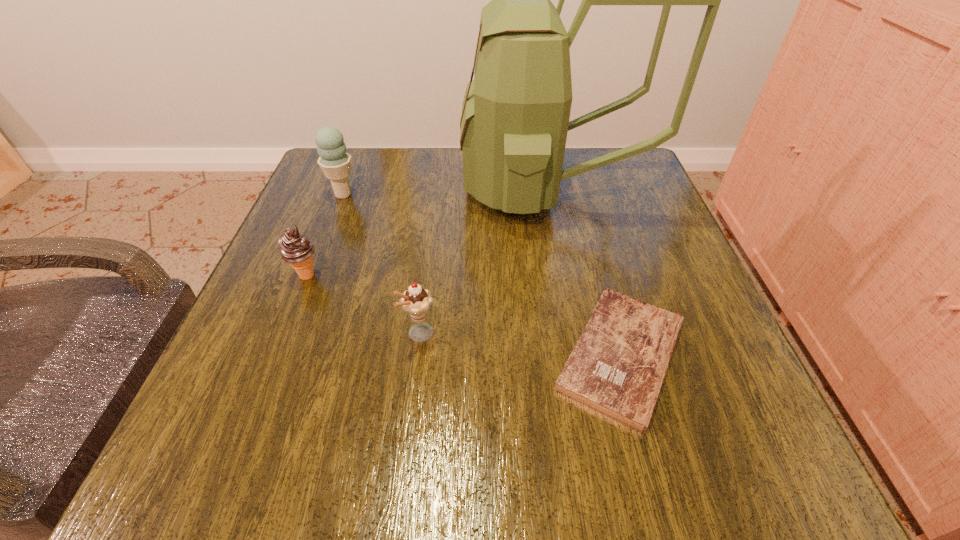
Where is `free spot between the tallest icecream and the second farthest icecream`? This screenshot has height=540, width=960. free spot between the tallest icecream and the second farthest icecream is located at coordinates (325, 235).

Identify the location of free space between the third nearest object and the tallest object. (428, 233).

This screenshot has height=540, width=960. I want to click on free space between the third object from right to left and the backpack, so click(x=486, y=262).

Where is `free space between the nearest icecream and the third farthest object`? free space between the nearest icecream and the third farthest object is located at coordinates (364, 305).

Locate an element on the screen. This screenshot has width=960, height=540. empty location between the shortest object and the second farthest icecream is located at coordinates (465, 315).

At what (x,y) coordinates should I click in order to perform the action: click on free space that is in between the rightmost icecream and the second nearest icecream. Please return your answer as a coordinate pair (x, y). This screenshot has width=960, height=540. Looking at the image, I should click on (364, 305).

Where is `vacant space in between the farthest icecream and the shortest object`? vacant space in between the farthest icecream and the shortest object is located at coordinates (482, 274).

Locate an element on the screen. Image resolution: width=960 pixels, height=540 pixels. free space between the second nearest icecream and the tallest icecream is located at coordinates coord(325,235).

What are the coordinates of `the second closest object to the shortest object` in the screenshot? It's located at (416, 301).

Point out which object is positioned as the fourth nearest to the second nearest icecream. Please provide its 2D coordinates. Your answer should be formatted as a tuple, i.e. [(x, y)], where the tuple contains the x and y coordinates of a point satisfying the conditions above.

[(617, 367)]